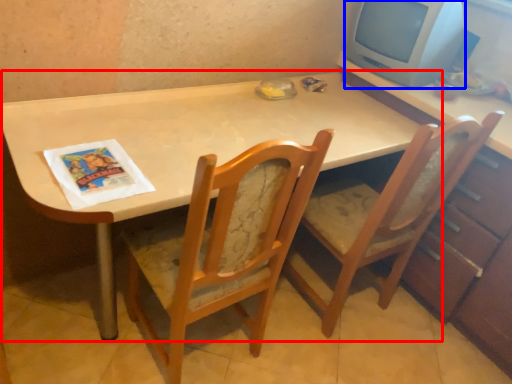
Question: Which object is closer to the camera taking this photo, table (highlighted by a red box) or computer monitor (highlighted by a blue box)?

Choices:
 (A) table
 (B) computer monitor

Answer: (A)